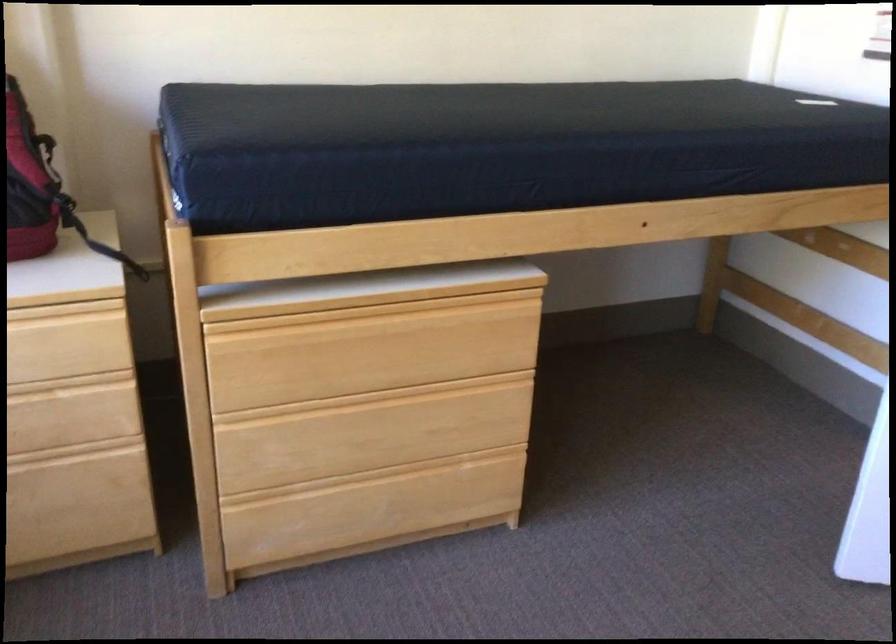
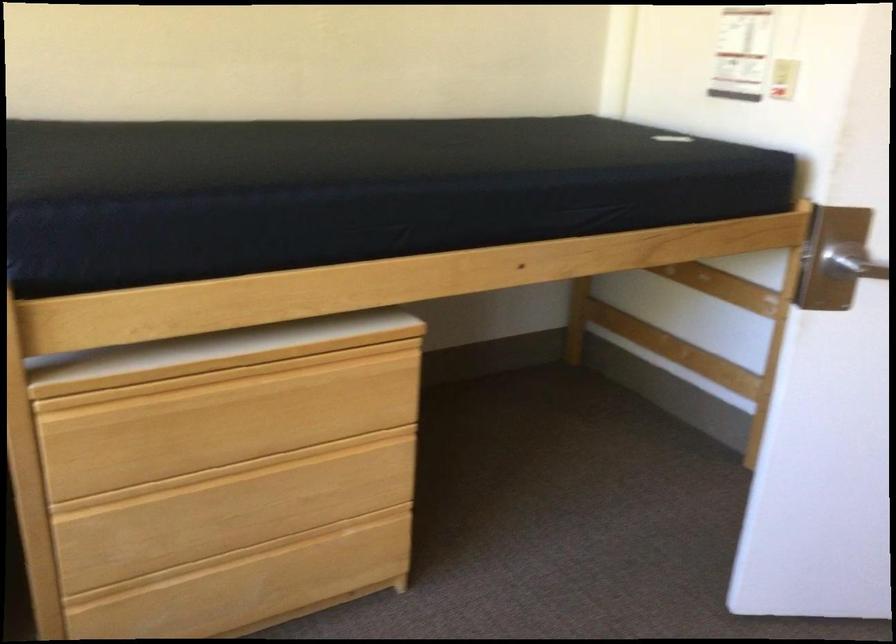
The point at (369, 308) is marked in the first image. Where is the corresponding point in the second image?

(227, 375)